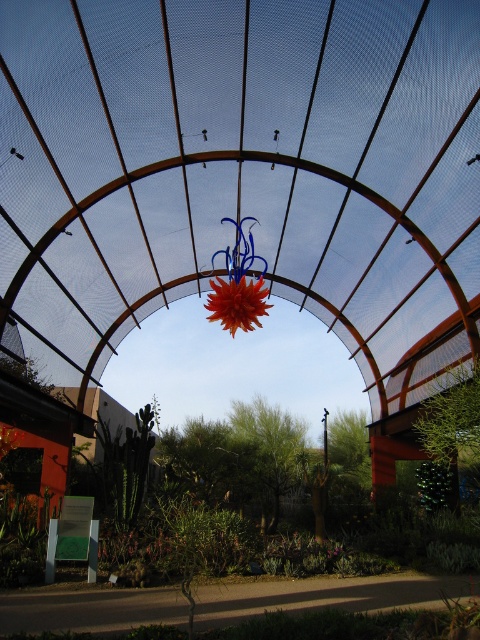
From the picture: You are standing at the entrance of the botanical garden and see the transparent mesh canopy at center and the shiny orange flower at center. Which object is closer to your right side?

The shiny orange flower at center is closer to your right side because the transparent mesh canopy at center is to the left of it.

You are planning to install a new lighting fixture under the transparent mesh canopy at center. The fixture you have is wider than the shiny orange flower at center. Will it fit under the canopy?

The transparent mesh canopy at center is wider than the shiny orange flower at center, so if your lighting fixture is wider than the shiny orange flower at center, it should fit under the canopy as long as it doesn not exceed the canopy width.